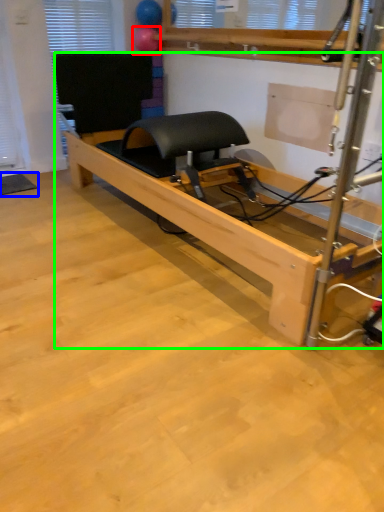
Question: Which object is the farthest from balloon (highlighted by a red box)? Choose among these: yoga mat (highlighted by a blue box) or furniture (highlighted by a green box).

Choices:
 (A) yoga mat
 (B) furniture

Answer: (A)